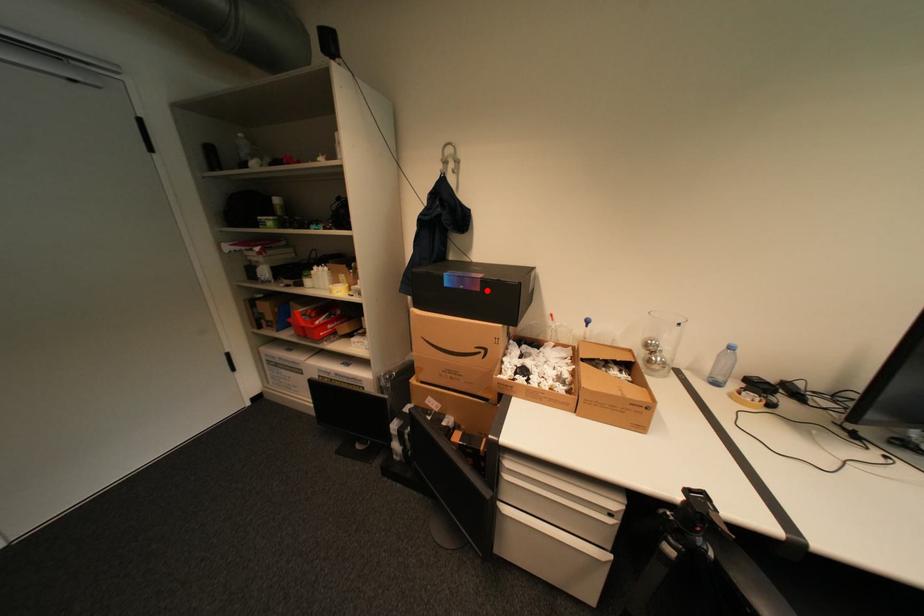
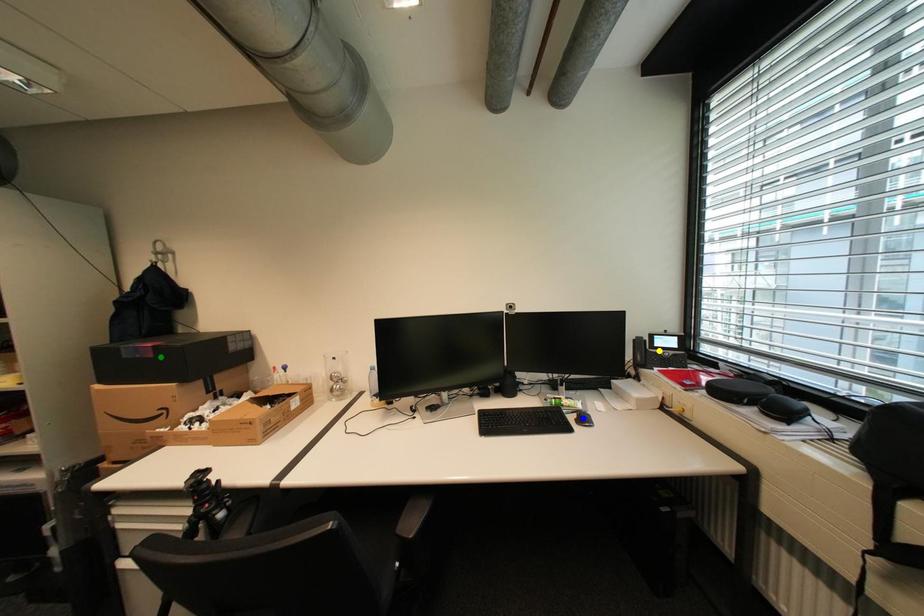
Question: I am providing you with two images of the same scene from different viewpoints. A red point is marked on the first image. You are given multiple points on the second image. Can you choose the point in image 2 that corresponds to the point in image 1?

Choices:
 (A) green point
 (B) yellow point
 (C) blue point

Answer: (A)